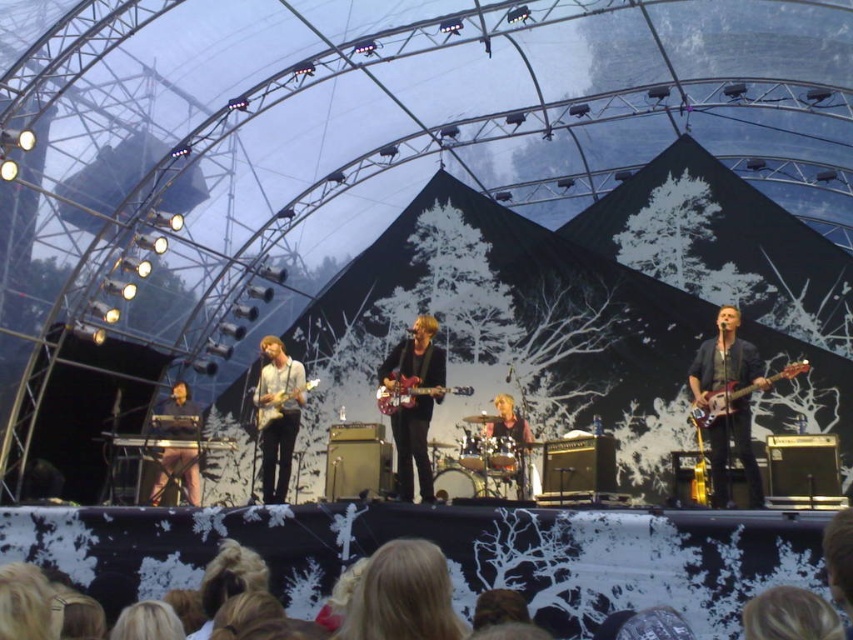
Question: Can you confirm if dark blue denim jacket at right is positioned above electric guitar at right?

Choices:
 (A) yes
 (B) no

Answer: (B)

Question: Among these objects, which one is nearest to the camera?

Choices:
 (A) electric guitar at right
 (B) matte wood guitar at center

Answer: (A)

Question: Does matte black keyboard at lower left have a smaller size compared to electric guitar at right?

Choices:
 (A) yes
 (B) no

Answer: (B)

Question: Is dark blue denim jacket at right to the left of matte black guitar at center from the viewer's perspective?

Choices:
 (A) no
 (B) yes

Answer: (A)

Question: Which point appears farthest from the camera in this image?

Choices:
 (A) (509, 401)
 (B) (282, 413)
 (C) (718, 476)

Answer: (A)

Question: Based on their relative distances, which object is farther from the matte black guitar at center?

Choices:
 (A) electric guitar at right
 (B) matte wood guitar at center

Answer: (A)